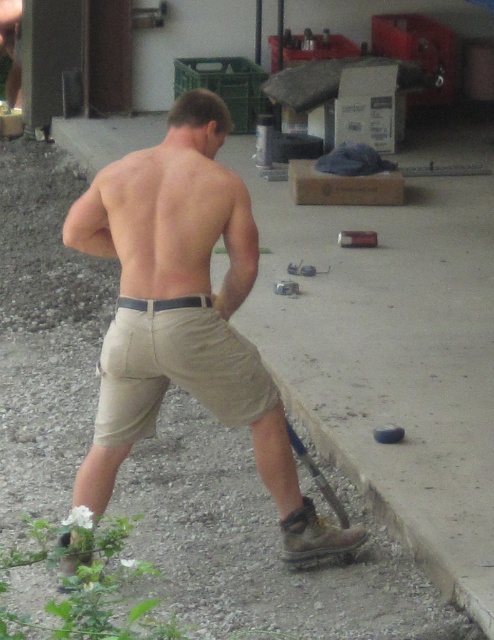
Question: Based on their relative distances, which object is nearer to the muscular tan skin at back?

Choices:
 (A) khaki cotton shorts at center
 (B) tan cotton shorts at center

Answer: (B)

Question: Is tan cotton shorts at center thinner than muscular tan skin at back?

Choices:
 (A) no
 (B) yes

Answer: (A)

Question: Which object is farther from the camera taking this photo?

Choices:
 (A) khaki cotton shorts at center
 (B) muscular tan skin at back
 (C) tan cotton shorts at center

Answer: (B)

Question: Can you confirm if tan cotton shorts at center is smaller than muscular tan skin at back?

Choices:
 (A) yes
 (B) no

Answer: (B)

Question: Is tan cotton shorts at center thinner than muscular tan skin at back?

Choices:
 (A) yes
 (B) no

Answer: (B)

Question: Which of the following is the closest to the observer?

Choices:
 (A) (175, 360)
 (B) (109, 336)
 (C) (196, 168)

Answer: (A)